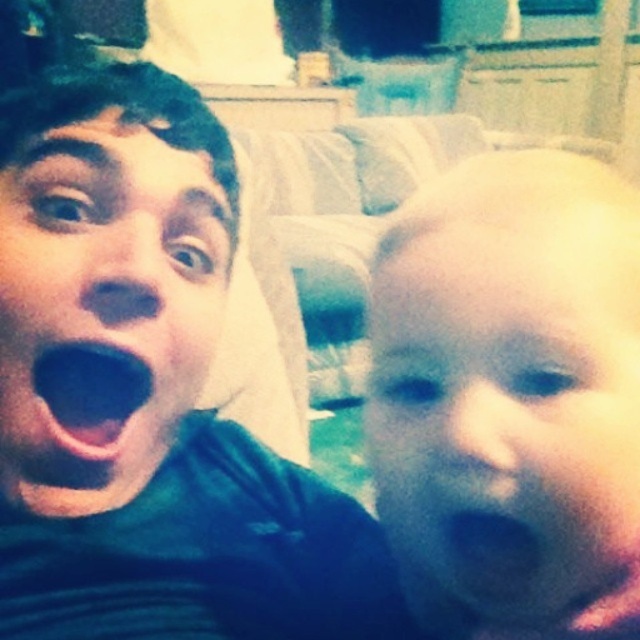
Question: Which object appears farthest from the camera in this image?

Choices:
 (A) black matte mouth at left
 (B) green matte face at left
 (C) blue matte mouth at lower right
 (D) smooth skin baby at right

Answer: (A)

Question: Does black matte mouth at left have a lesser width compared to blue matte mouth at lower right?

Choices:
 (A) yes
 (B) no

Answer: (B)

Question: Observing the image, what is the correct spatial positioning of black matte mouth at left in reference to blue matte mouth at lower right?

Choices:
 (A) above
 (B) below

Answer: (A)

Question: Is green matte face at left to the right of black matte mouth at left from the viewer's perspective?

Choices:
 (A) yes
 (B) no

Answer: (A)

Question: Which point is farther to the camera?

Choices:
 (A) black matte mouth at left
 (B) green matte face at left
 (C) smooth skin baby at right

Answer: (A)

Question: Which point appears closest to the camera in this image?

Choices:
 (A) (634, 621)
 (B) (122, 376)
 (C) (476, 545)
 (D) (100, 176)

Answer: (C)